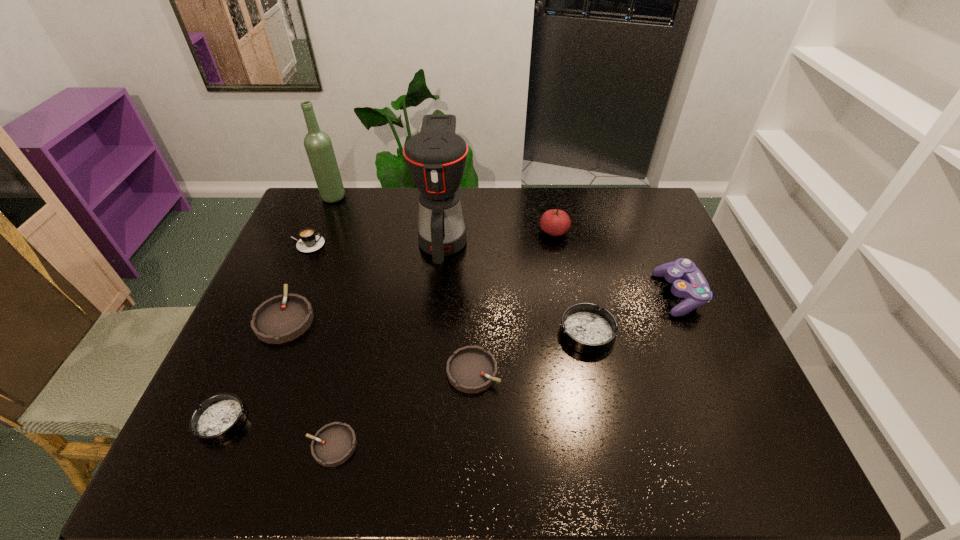
Locate an element on the screen. This screenshot has height=540, width=960. vacant space located 0.280m on the front of the control is located at coordinates (732, 415).

At what (x,y) coordinates should I click in order to perform the action: click on vacant space located 0.390m with the handle on the side of the cappuccino. Please return your answer as a coordinate pair (x, y). This screenshot has width=960, height=540. Looking at the image, I should click on (446, 245).

This screenshot has width=960, height=540. Identify the location of vacant space located 0.190m on the back of the leftmost gray ashtray. (313, 249).

In order to click on free location located on the right of the bigger dark ashtray in this screenshot , I will do `click(683, 333)`.

Locate an element on the screen. vacant area situated on the left of the second smallest gray ashtray is located at coordinates (386, 371).

Find the location of a particular element. Image resolution: width=960 pixels, height=540 pixels. vacant space situated on the right of the nearer dark ashtray is located at coordinates (295, 421).

Find the location of a particular element. Image resolution: width=960 pixels, height=540 pixels. free point located on the right of the shortest object is located at coordinates (510, 446).

Find the location of a particular element. The width and height of the screenshot is (960, 540). wine bottle located at the far edge is located at coordinates (318, 145).

You are a GUI agent. You are given a task and a screenshot of the screen. Output one action in this format:
    pyautogui.click(x=<x>, y=<y>)
    Task: Click on the coffee maker at the far edge
    
    Given the screenshot: What is the action you would take?
    pyautogui.click(x=436, y=157)

This screenshot has height=540, width=960. I want to click on tomato present at the far edge, so click(x=555, y=222).